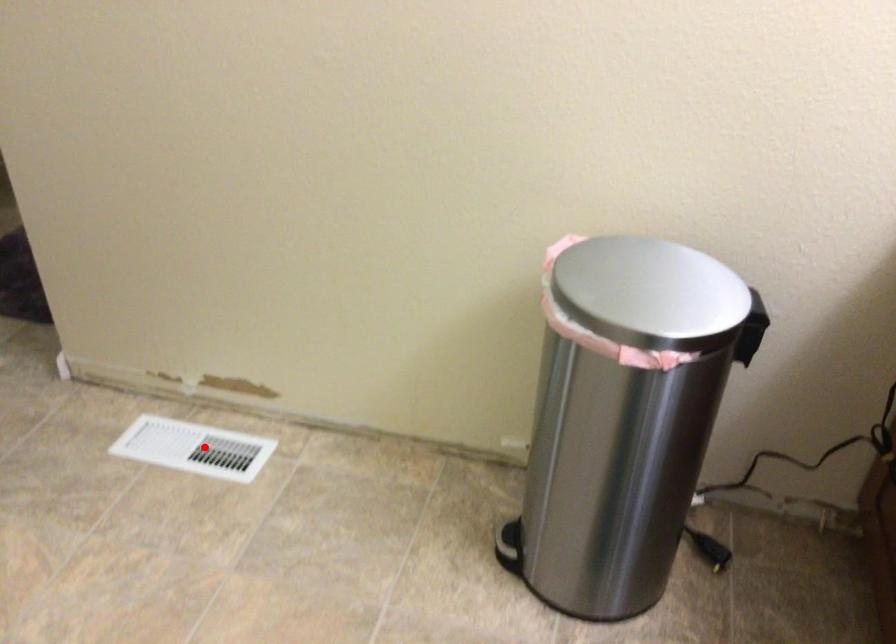
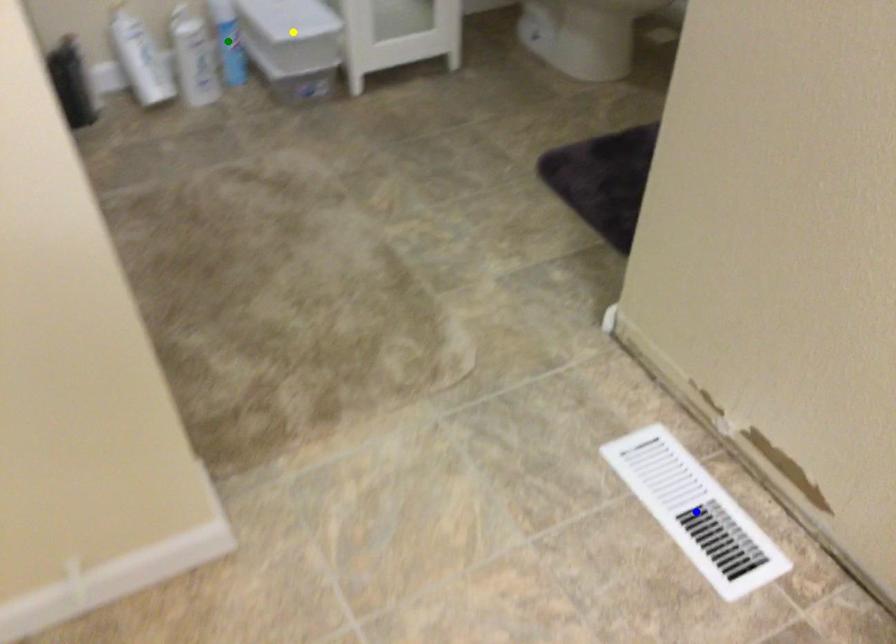
Question: I am providing you with two images of the same scene from different viewpoints. A red point is marked on the first image. You are given multiple points on the second image. Which mark in image 2 goes with the point in image 1?

Choices:
 (A) yellow point
 (B) green point
 (C) blue point

Answer: (C)